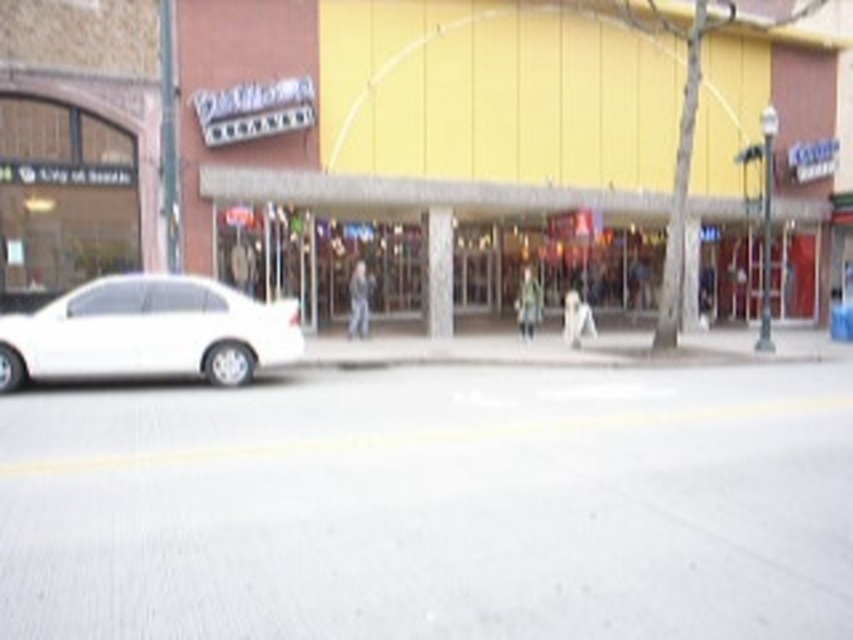
Is yellow matte mall at center taller than white glossy sedan at left?

Yes.

Find the location of `yellow matte mall at center`. yellow matte mall at center is located at coordinates (427, 147).

In the scene shown: Is yellow matte mall at center shorter than matte glass storefront at center?

No.

Can you confirm if yellow matte mall at center is wider than matte glass storefront at center?

Indeed, yellow matte mall at center has a greater width compared to matte glass storefront at center.

Is point (312, 262) closer to viewer compared to point (289, 196)?

No, it is not.

The height and width of the screenshot is (640, 853). I want to click on yellow matte mall at center, so click(x=427, y=147).

Is point (227, 308) positioned before point (337, 179)?

Yes, point (227, 308) is closer to viewer.

Is white glossy sedan at left to the left of matte glass storefront at center from the viewer's perspective?

Correct, you'll find white glossy sedan at left to the left of matte glass storefront at center.

Is point (227, 337) less distant than point (726, 218)?

Yes, point (227, 337) is in front of point (726, 218).

Locate an element on the screen. The image size is (853, 640). white glossy sedan at left is located at coordinates point(149,332).